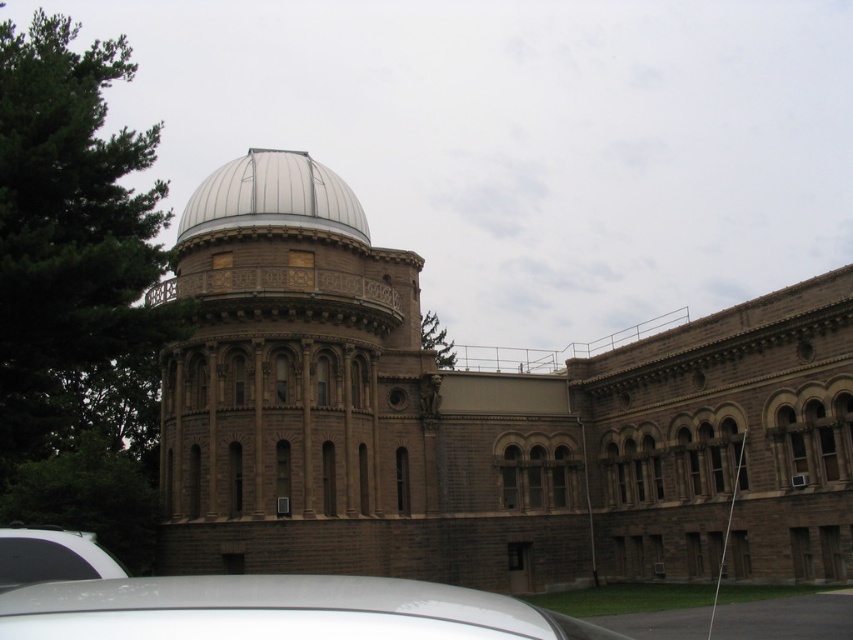
Based on the photo, you are an architect evaluating the spatial requirements for a new addition to the building. You need to determine which object, the brown stone tower at center or the white matte dome at upper center, requires more horizontal space for construction. Based on the image, which one would you prioritize for space allocation?

The white matte dome at upper center requires more horizontal space because it occupies more space than the brown stone tower at center, so it should be prioritized for space allocation.

You are standing in front of the historic building and notice the brown stone tower at center and the white glossy car at lower left. Which object takes up more space in the image?

The brown stone tower at center is larger in size than the white glossy car at lower left, so it takes up more space in the image.